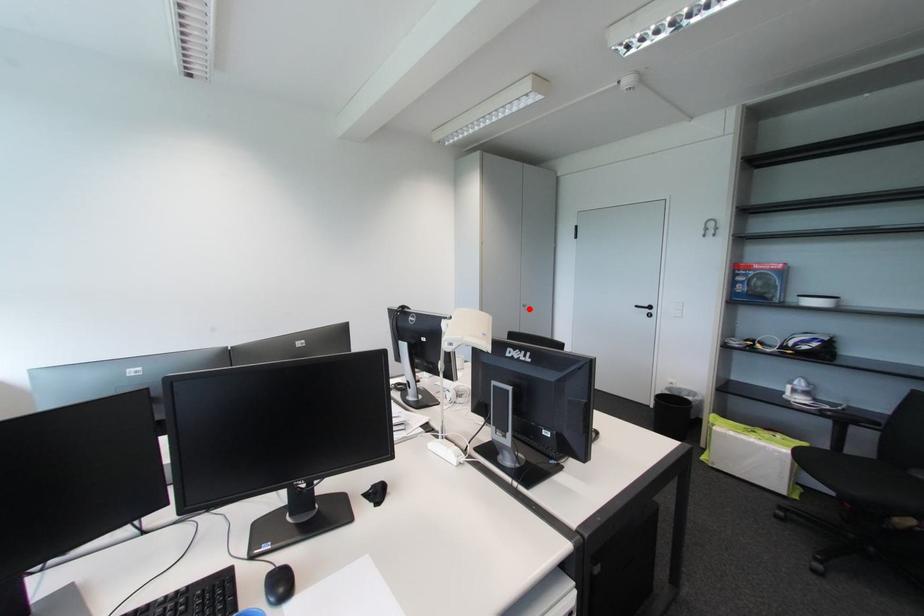
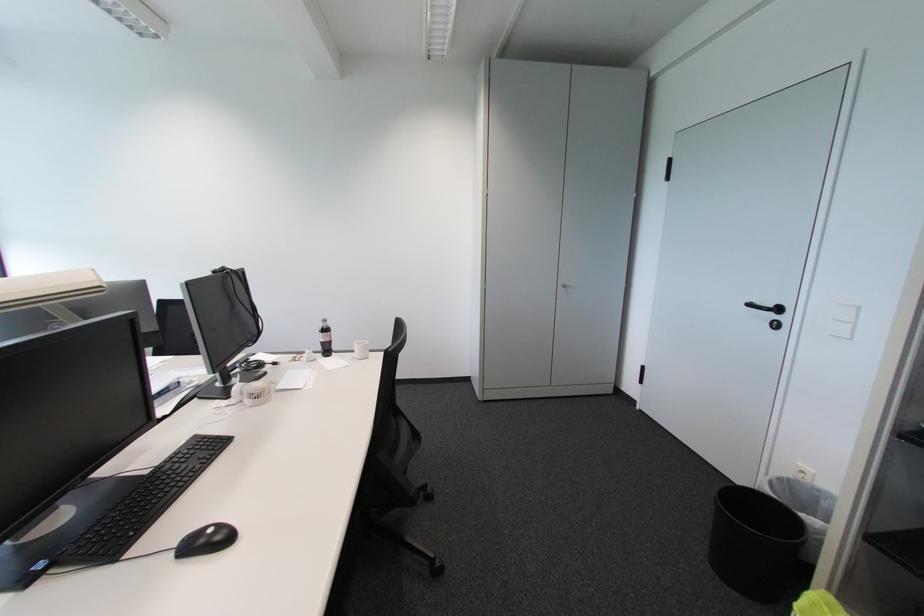
The point at the highlighted location is marked in the first image. Where is the corresponding point in the second image?

(567, 290)